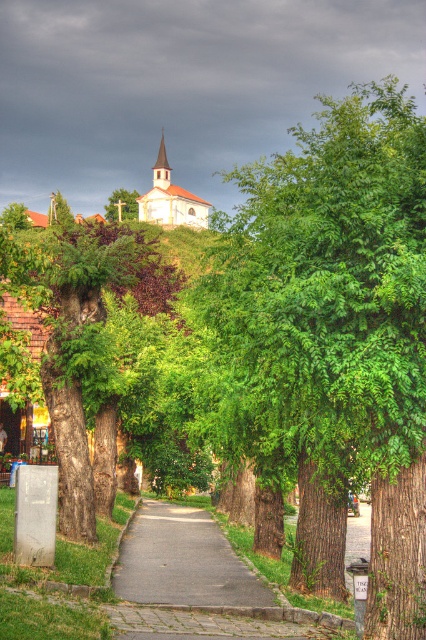
Which is behind, point (152, 579) or point (109, 211)?

The point (109, 211) is behind.

Which is in front, point (161, 554) or point (123, 198)?

Point (161, 554) is in front.

The width and height of the screenshot is (426, 640). I want to click on gray asphalt path at center, so click(x=183, y=561).

Can you confirm if smooth brown tree trunk at center is wider than white matte church at center?

No, smooth brown tree trunk at center is not wider than white matte church at center.

Can you confirm if smooth brown tree trunk at center is smaller than white matte church at center?

Correct, smooth brown tree trunk at center occupies less space than white matte church at center.

Does point (74, 380) lie behind point (146, 208)?

No, (74, 380) is closer to viewer.

Identify the location of smooth brown tree trunk at center. (80, 337).

Can you confirm if green leafy tree at center is positioned to the right of gray asphalt path at center?

Indeed, green leafy tree at center is positioned on the right side of gray asphalt path at center.

Between green leafy tree at center and gray asphalt path at center, which one is positioned lower?

Positioned lower is gray asphalt path at center.

Between point (296, 406) and point (204, 513), which one is positioned in front?

Point (296, 406)

Find the location of `green leafy tree at center`. green leafy tree at center is located at coordinates (336, 326).